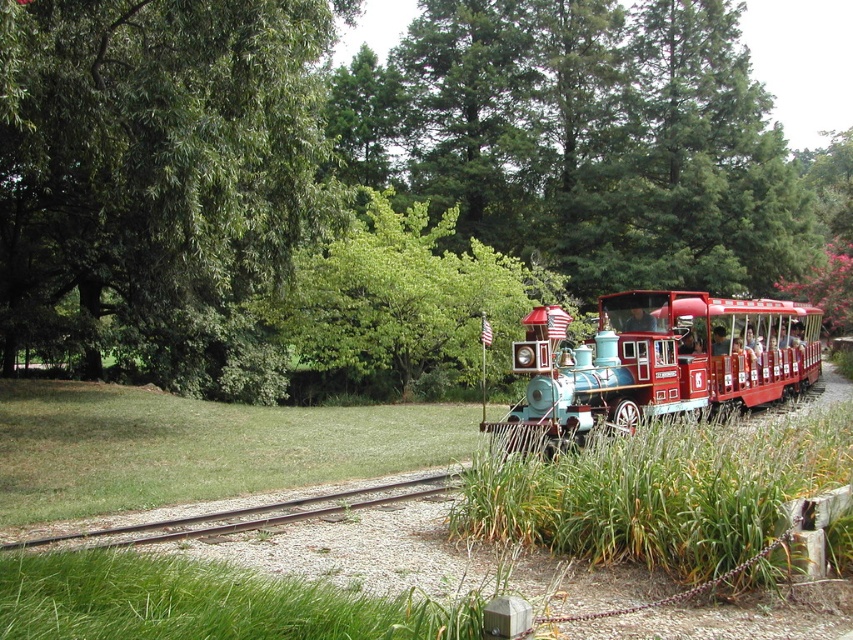
You are a passenger on the train and looking out the window. You see a green leafy tree at center and a brown gravel track at lower center. Which object appears taller from your viewpoint?

The green leafy tree at center appears taller than the brown gravel track at lower center from your viewpoint.

You are a passenger on the train and looking out the window. You see a green leafy tree at center and a brown gravel track at lower center. Which object is positioned to the right side of the other?

The green leafy tree at center is to the right of brown gravel track at lower center.

You are a passenger on the shiny red train at right and want to get off at the next stop. However, you notice the brown gravel track at lower center. Which side of the track should you exit onto to stay safe?

The shiny red train at right is positioned on the right side of brown gravel track at lower center, so exiting onto the left side of the track would keep you safe as it is away from the train.